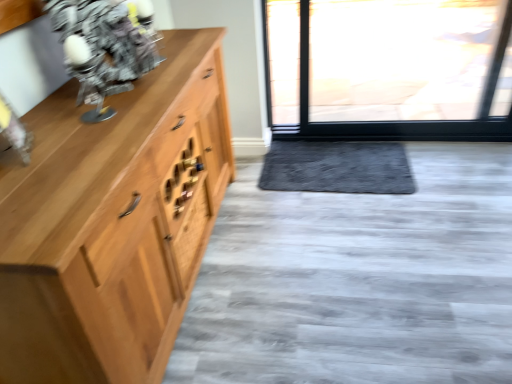
Question: Is wooden drawer at center wider or thinner than metallic silver robot at upper left?

Choices:
 (A) thin
 (B) wide

Answer: (A)

Question: Is wooden drawer at center to the left or to the right of metallic silver robot at upper left in the image?

Choices:
 (A) left
 (B) right

Answer: (B)

Question: Which object is the closest to the wooden drawer at center?

Choices:
 (A) gray plush doormat at center
 (B) metallic silver robot at upper left

Answer: (B)

Question: Estimate the real-world distances between objects in this image. Which object is farther from the metallic silver robot at upper left?

Choices:
 (A) wooden drawer at center
 (B) gray plush doormat at center

Answer: (B)